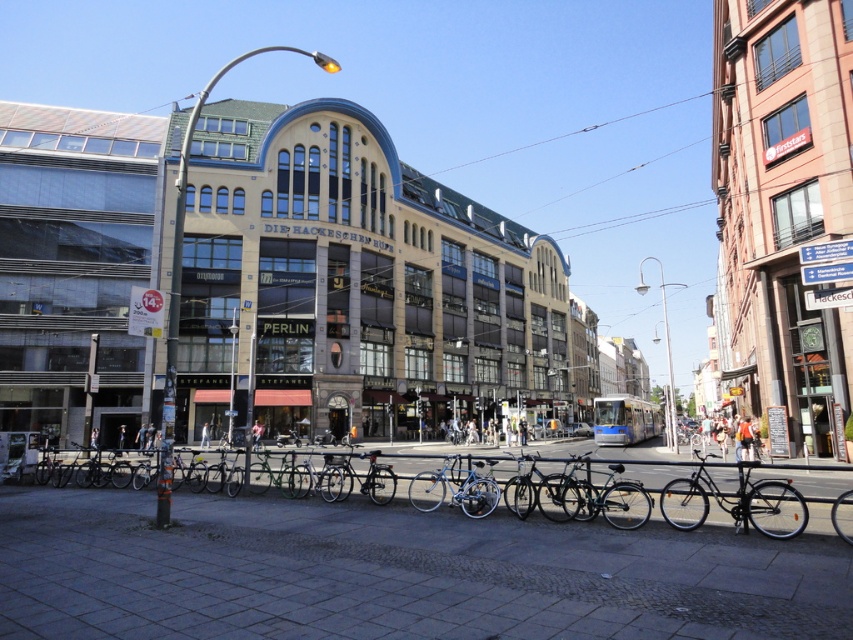
Who is shorter, shiny blue bicycle at center or dark blue jeans at lower left?

Standing shorter between the two is dark blue jeans at lower left.

Describe the element at coordinates (456, 490) in the screenshot. I see `shiny blue bicycle at center` at that location.

Where is `shiny blue bicycle at center`? shiny blue bicycle at center is located at coordinates (456, 490).

Can you confirm if white cotton shirt at center is positioned to the right of dark blue jeans at center?

→ Indeed, white cotton shirt at center is positioned on the right side of dark blue jeans at center.

Find the location of a particular element. white cotton shirt at center is located at coordinates (206, 435).

Is shiny black bicycle at lower left bigger than dark blue jeans at center?

Indeed, shiny black bicycle at lower left has a larger size compared to dark blue jeans at center.

Who is more distant from viewer, [793,536] or [97,445]?

Positioned behind is point [97,445].

Between point (595, 499) and point (91, 435), which one is positioned behind?

The point (91, 435) is more distant.

You are a GUI agent. You are given a task and a screenshot of the screen. Output one action in this format:
    pyautogui.click(x=<x>, y=<y>)
    Task: Click on the shiny black bicycle at lower left
    The width and height of the screenshot is (853, 640).
    Given the screenshot: What is the action you would take?
    pyautogui.click(x=616, y=492)